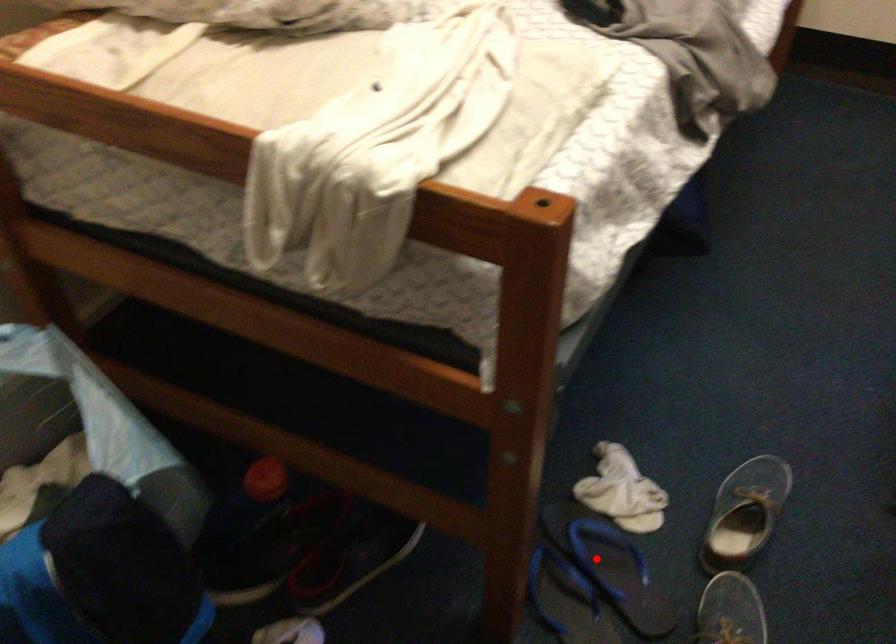
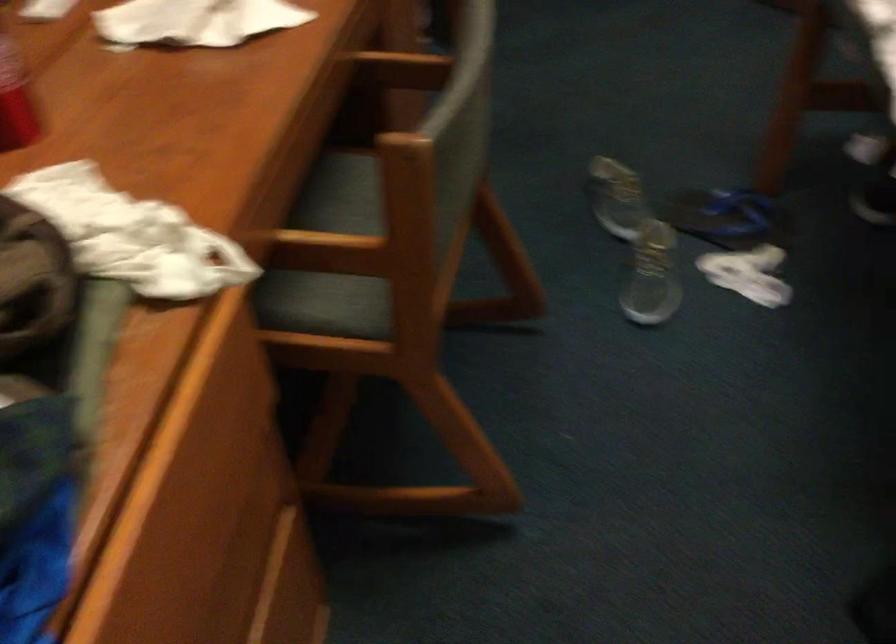
Locate, in the second image, the point that corresponds to the highlighted location in the first image.

(728, 218)